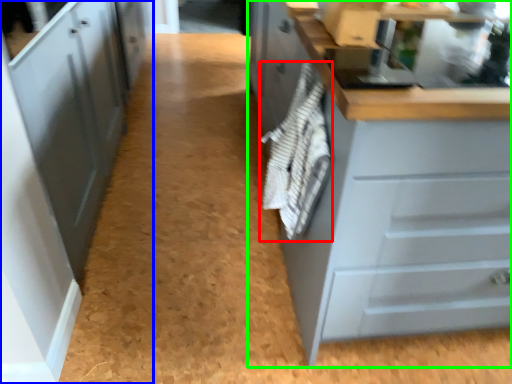
Question: Considering the real-world distances, which object is closest to material (highlighted by a red box)? cabinetry (highlighted by a blue box) or cabinetry (highlighted by a green box).

Choices:
 (A) cabinetry
 (B) cabinetry

Answer: (B)